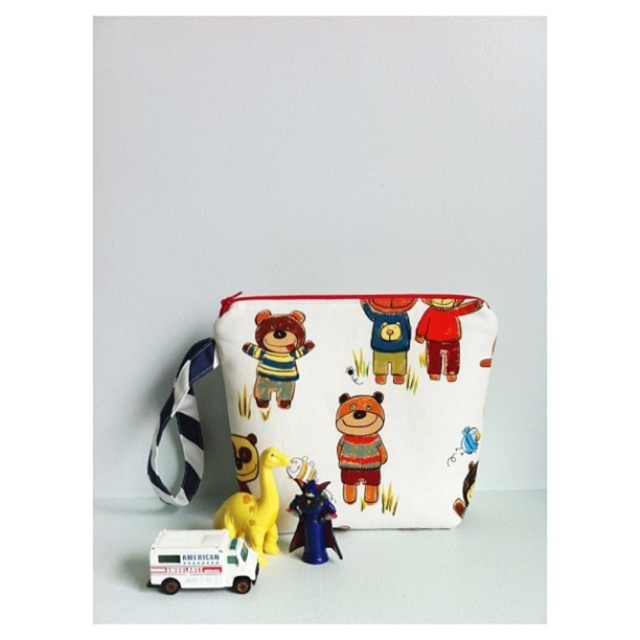
You are a GUI agent. You are given a task and a screenshot of the screen. Output one action in this format:
    pyautogui.click(x=<x>, y=<y>)
    Task: Click on the soft plush bear at center
    
    Given the screenshot: What is the action you would take?
    276,356

Identify the location of soft plush bear at center. This screenshot has width=640, height=640. (276, 356).

In the scene shown: How much distance is there between white plastic toy car at lower left and metallic blue figurine at lower center?

white plastic toy car at lower left and metallic blue figurine at lower center are 4.80 inches apart from each other.

How distant is white plastic toy car at lower left from metallic blue figurine at lower center?

They are 4.80 inches apart.

Between point (202, 557) and point (312, 496), which one is positioned in front?

Point (202, 557) is more forward.

Where is `white plastic toy car at lower left`? The image size is (640, 640). white plastic toy car at lower left is located at coordinates (200, 561).

Does yellow rubber dinosaur at lower center have a smaller size compared to red fabric teddy bear at center?

Actually, yellow rubber dinosaur at lower center might be larger than red fabric teddy bear at center.

Is point (266, 541) closer to camera compared to point (445, 371)?

Yes.

What are the coordinates of `yellow rubber dinosaur at lower center` in the screenshot? It's located at (256, 508).